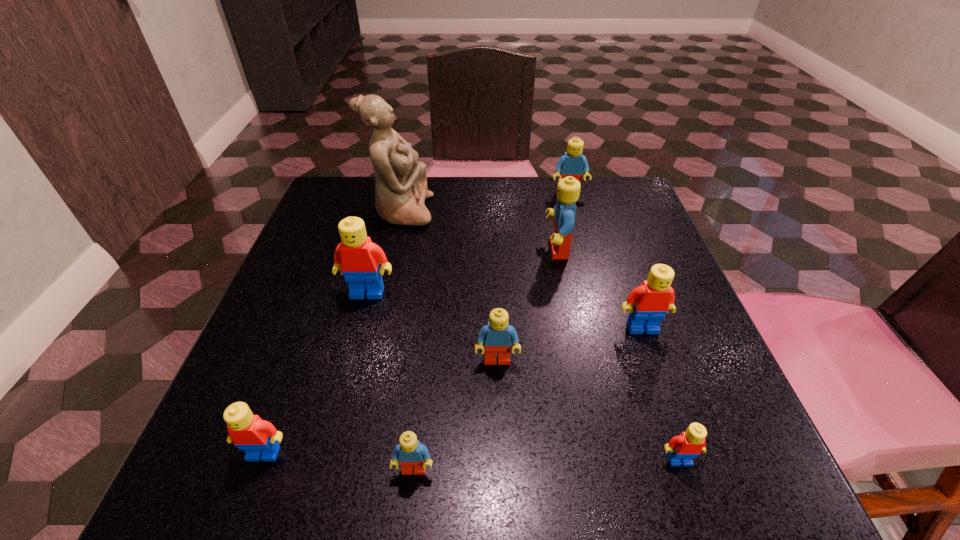
This screenshot has height=540, width=960. Find the location of `unoccupied area between the second smallest red Lego and the figurine`. unoccupied area between the second smallest red Lego and the figurine is located at coordinates (333, 332).

This screenshot has width=960, height=540. In order to click on free space between the sixth nearest Lego and the seventh nearest Lego in this screenshot , I will do `click(463, 271)`.

Locate an element on the screen. This screenshot has width=960, height=540. vacant space that is in between the second smallest blue Lego and the biggest red Lego is located at coordinates (432, 327).

In order to click on object that is the seventh closest to the smallest red Lego in this screenshot , I will do `click(401, 188)`.

Identify which object is the eighth closest to the third biggest red Lego. Please provide its 2D coordinates. Your answer should be formatted as a tuple, i.e. [(x, y)], where the tuple contains the x and y coordinates of a point satisfying the conditions above.

[(572, 163)]

You are a GUI agent. You are given a task and a screenshot of the screen. Output one action in this format:
    pyautogui.click(x=<x>, y=<y>)
    Task: Click on the Lego that is the fourth closest to the sixth nearest object
    The height and width of the screenshot is (540, 960).
    Given the screenshot: What is the action you would take?
    pyautogui.click(x=411, y=453)

I want to click on the fifth closest Lego to the leftmost blue Lego, so click(x=648, y=304).

Locate which blue Lego is the closest to the seventh nearest object. Please provide its 2D coordinates. Your answer should be formatted as a tuple, i.e. [(x, y)], where the tuple contains the x and y coordinates of a point satisfying the conditions above.

[(572, 163)]

I want to click on blue Lego identified as the closest to the second biggest blue Lego, so click(568, 189).

Find the location of a particular element. The width and height of the screenshot is (960, 540). red Lego that is the closest to the fourth nearest Lego is located at coordinates (648, 304).